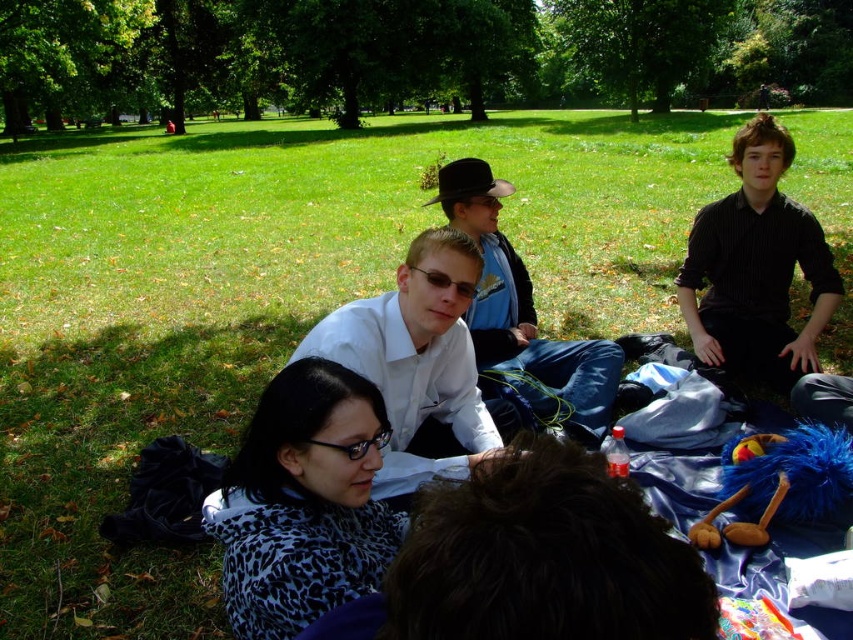
Can you confirm if black striped shirt at center is thinner than blue fuzzy plush toy at lower right?

In fact, black striped shirt at center might be wider than blue fuzzy plush toy at lower right.

In the scene shown: Which of these two, black striped shirt at center or blue fuzzy plush toy at lower right, stands taller?

black striped shirt at center

Between point (732, 236) and point (824, 435), which one is positioned behind?

The point (732, 236) is behind.

Image resolution: width=853 pixels, height=640 pixels. In order to click on black striped shirt at center in this screenshot , I will do `click(756, 268)`.

Is leopard print coat at lower left above black striped shirt at center?

No.

Is leopard print coat at lower left bigger than black striped shirt at center?

No.

Who is more forward, (367, 506) or (700, 228)?

Point (367, 506) is in front.

What are the coordinates of `leopard print coat at lower left` in the screenshot? It's located at (303, 502).

Is leopard print coat at lower left smaller than blue fuzzy plush toy at lower right?

Incorrect, leopard print coat at lower left is not smaller in size than blue fuzzy plush toy at lower right.

Locate an element on the screen. This screenshot has width=853, height=640. leopard print coat at lower left is located at coordinates (303, 502).

Identify the location of leopard print coat at lower left. (303, 502).